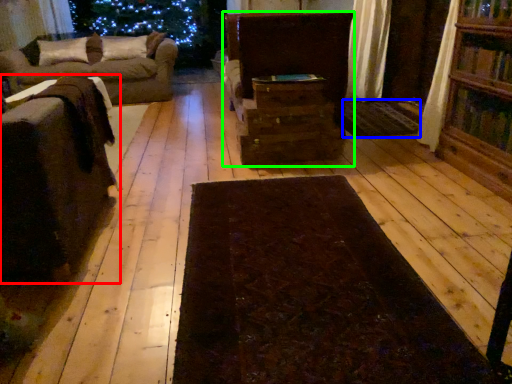
Question: Based on their relative distances, which object is nearer to furniture (highlighted by a red box)? Choose from mat (highlighted by a blue box) and furniture (highlighted by a green box).

Choices:
 (A) mat
 (B) furniture

Answer: (B)